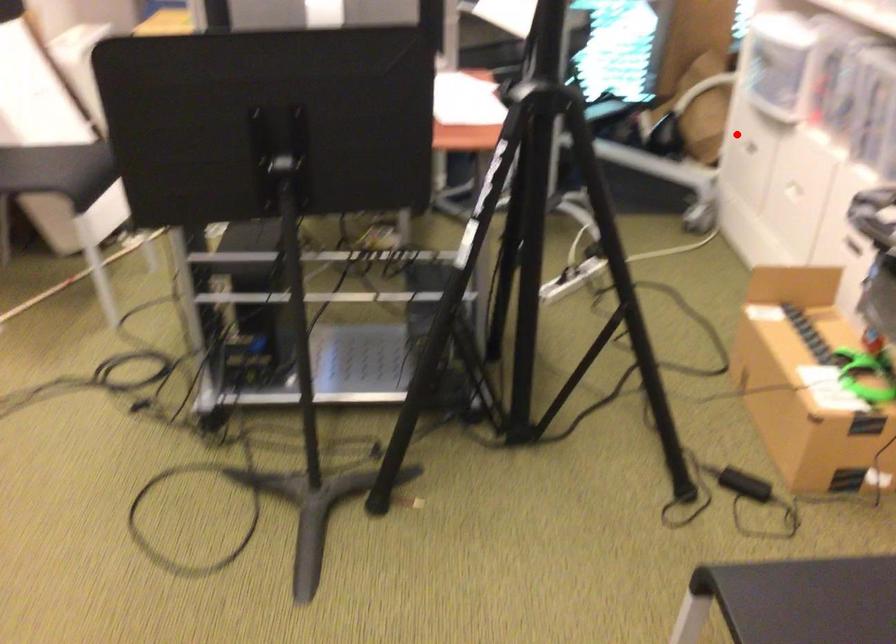
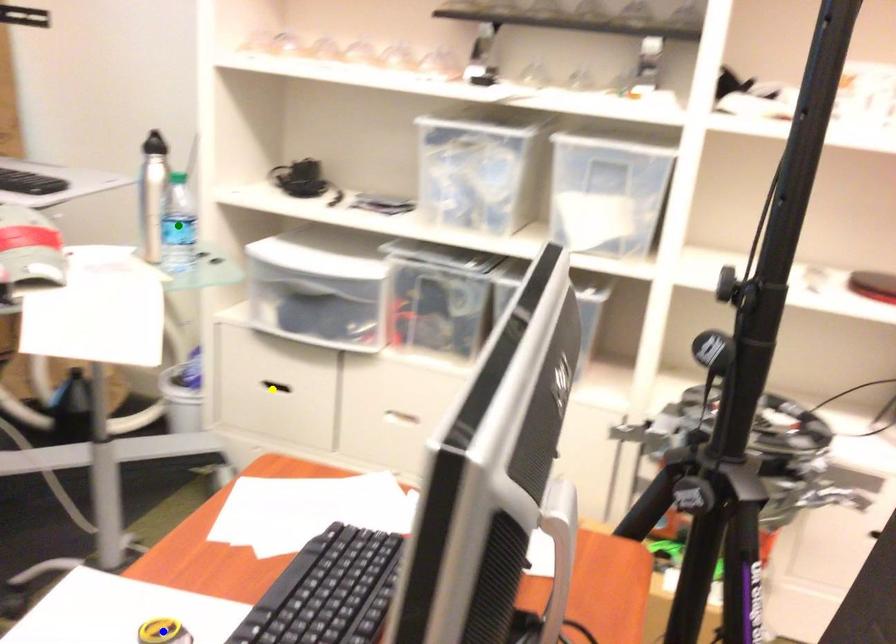
Question: I am providing you with two images of the same scene from different viewpoints. A red point is marked on the first image. You are given multiple points on the second image. Which point in image 2 represents the same 3d spot as the red point in image 1?

Choices:
 (A) yellow point
 (B) blue point
 (C) green point

Answer: (A)